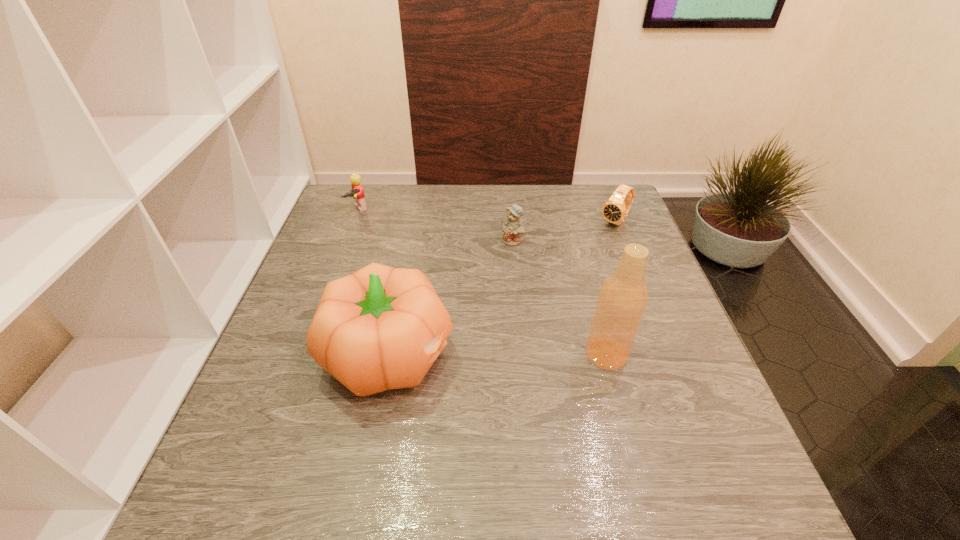
Image resolution: width=960 pixels, height=540 pixels. Find the location of `vacant space in between the fourth object from right to left and the tallest object`. vacant space in between the fourth object from right to left and the tallest object is located at coordinates (498, 354).

Where is `free space between the pumpkin and the rightmost object`? The height and width of the screenshot is (540, 960). free space between the pumpkin and the rightmost object is located at coordinates (503, 288).

Where is `blank region between the second object from right to left and the Lego`? blank region between the second object from right to left and the Lego is located at coordinates (482, 282).

Select which object appears as the fourth closest to the pumpkin. Please provide its 2D coordinates. Your answer should be formatted as a tuple, i.e. [(x, y)], where the tuple contains the x and y coordinates of a point satisfying the conditions above.

[(615, 209)]

Identify which object is the fourth closest to the watch. Please provide its 2D coordinates. Your answer should be formatted as a tuple, i.e. [(x, y)], where the tuple contains the x and y coordinates of a point satisfying the conditions above.

[(357, 193)]

Where is `free region that satisfies the following two spatial constraints: 1. on the front side of the leftmost object; 2. on the left side of the teddy bear`? free region that satisfies the following two spatial constraints: 1. on the front side of the leftmost object; 2. on the left side of the teddy bear is located at coordinates (347, 241).

At what (x,y) coordinates should I click in order to perform the action: click on free point that satisfies the following two spatial constraints: 1. on the front side of the rightmost object; 2. on the left side of the leftmost object. Please return your answer as a coordinate pair (x, y). This screenshot has width=960, height=540. Looking at the image, I should click on (354, 221).